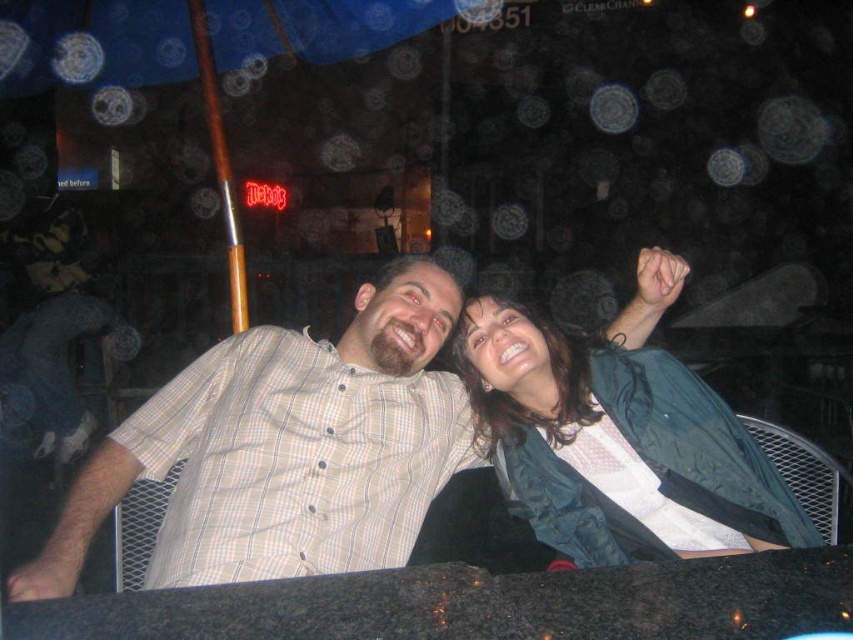
Question: Estimate the real-world distances between objects in this image. Which object is farther from the light brown plaid shirt at left?

Choices:
 (A) plaid shirt at center
 (B) green fabric jacket at upper right

Answer: (B)

Question: Which of the following is the closest to the observer?

Choices:
 (A) plaid shirt at center
 (B) light brown plaid shirt at left

Answer: (A)

Question: Considering the relative positions of green fabric jacket at upper right and plaid shirt at center in the image provided, where is green fabric jacket at upper right located with respect to plaid shirt at center?

Choices:
 (A) below
 (B) above

Answer: (B)

Question: Does plaid shirt at center have a greater width compared to light brown plaid shirt at left?

Choices:
 (A) yes
 (B) no

Answer: (A)

Question: Can you confirm if green fabric jacket at upper right is smaller than plaid shirt at center?

Choices:
 (A) yes
 (B) no

Answer: (A)

Question: Which point is farther from the camera taking this photo?

Choices:
 (A) (51, 433)
 (B) (517, 305)
 (C) (669, 253)

Answer: (A)